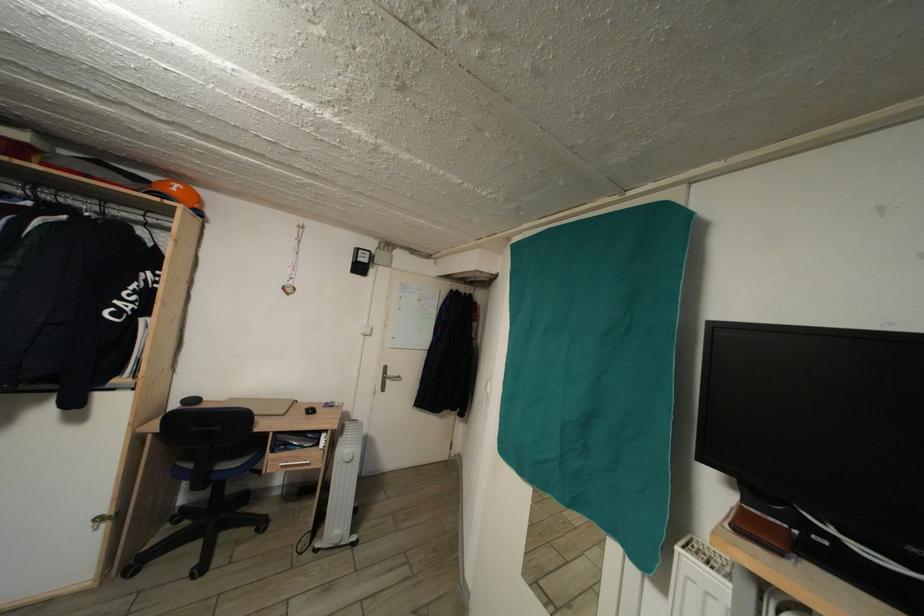
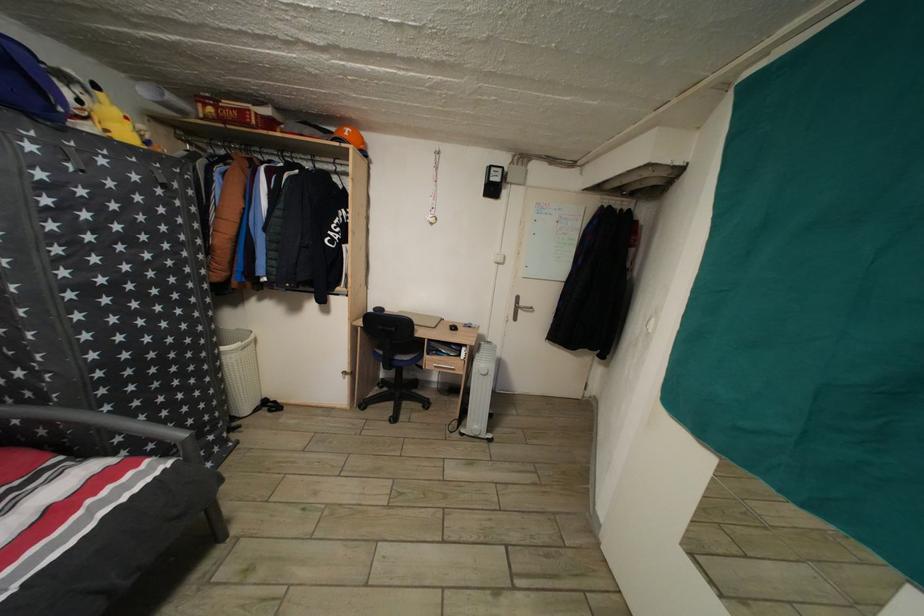
Question: The camera is either moving clockwise (left) or counter-clockwise (right) around the object. The first image is from the beginning of the video and the second image is from the end. Is the camera moving left or right when shooting the video?

Choices:
 (A) Left
 (B) Right

Answer: (B)